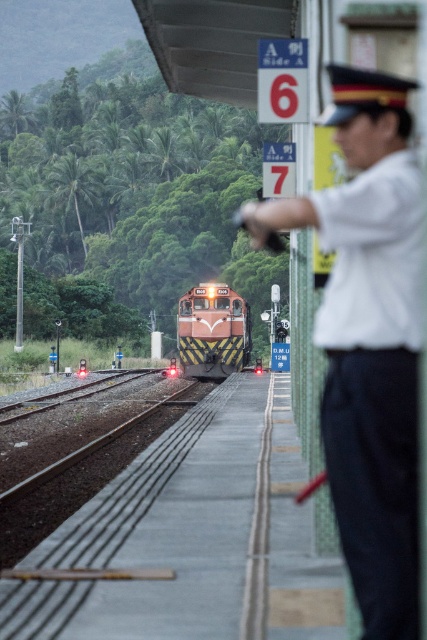
You are a passenger waiting on the platform. You see the white uniform at right and the matte orange train at center. Which object is closer to the platform edge?

The white uniform at right is closer to the platform edge because it is positioned to the right of the matte orange train at center, which is centered on the tracks.

You are a passenger on the platform waiting for your train. You notice the white uniform at right and the matte orange train at center. Which object is wider?

The matte orange train at center is wider than the white uniform at right.

You are standing on the platform at the railway station and want to take a photo of the train approaching. You have two points marked as potential spots to stand. The first is at point (x=388, y=358) and the second is at point (x=216, y=337). Which point will give you a better view of the train because it is closer to the camera?

Point (x=388, y=358) is closer to the camera than point (x=216, y=337), so standing there will give you a better view of the train.